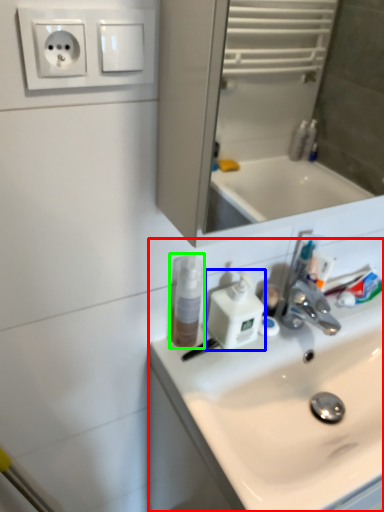
Question: Estimate the real-world distances between objects in this image. Which object is farther from sink (highlighted by a red box), soap dispenser (highlighted by a blue box) or mouthwash (highlighted by a green box)?

Choices:
 (A) soap dispenser
 (B) mouthwash

Answer: (B)